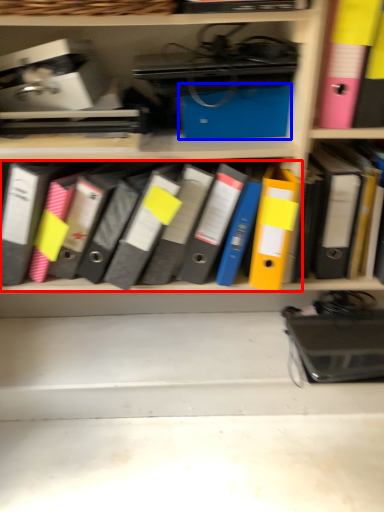
Question: Which object is further to the camera taking this photo, notebook (highlighted by a red box) or paperback book (highlighted by a blue box)?

Choices:
 (A) notebook
 (B) paperback book

Answer: (B)